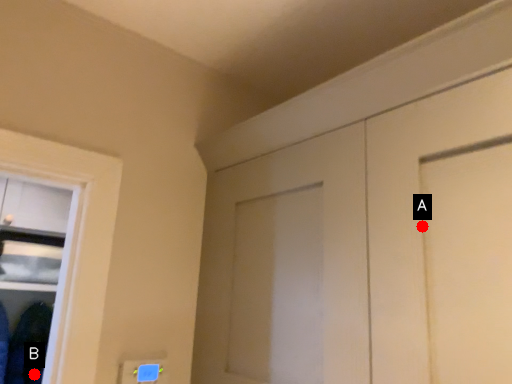
Question: Two points are circled on the image, labeled by A and B beside each circle. Which of the following is the farthest from the observer?

Choices:
 (A) A is further
 (B) B is further

Answer: (B)